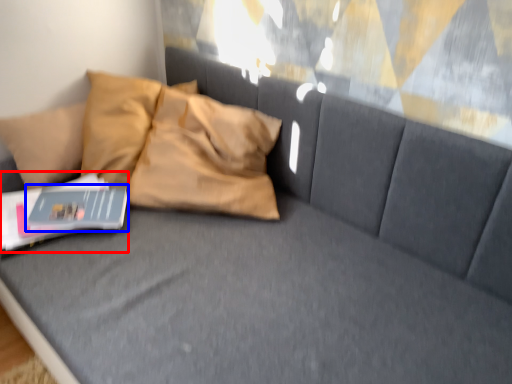
Question: Which object is further to the camera taking this photo, paperback book (highlighted by a red box) or magazine (highlighted by a blue box)?

Choices:
 (A) paperback book
 (B) magazine

Answer: (B)